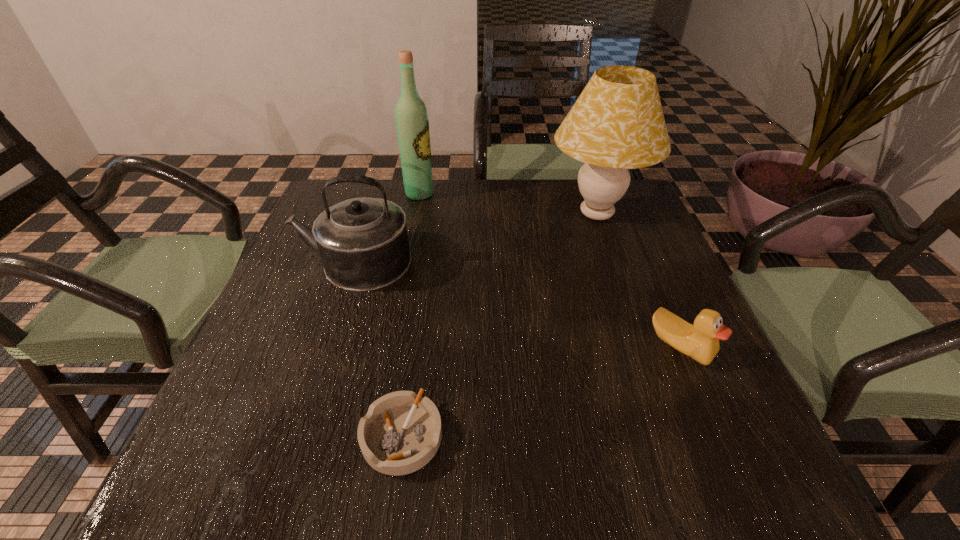
I want to click on vacant area at the left edge, so click(302, 316).

Where is `free space at the right edge of the desktop`? free space at the right edge of the desktop is located at coordinates (683, 280).

This screenshot has height=540, width=960. Find the location of `vacant point at the far left corner`. vacant point at the far left corner is located at coordinates (376, 197).

The height and width of the screenshot is (540, 960). Find the location of `vacant area at the near left corner of the desktop`. vacant area at the near left corner of the desktop is located at coordinates (262, 448).

The width and height of the screenshot is (960, 540). What are the coordinates of `blank space at the near right corner` in the screenshot? It's located at (730, 463).

Where is `empty location between the lampshade and the fourth tallest object`? The width and height of the screenshot is (960, 540). empty location between the lampshade and the fourth tallest object is located at coordinates (638, 281).

At what (x,y) coordinates should I click in order to perform the action: click on free area in between the fourth farthest object and the kettle. Please return your answer as a coordinate pair (x, y). This screenshot has width=960, height=540. Looking at the image, I should click on (517, 304).

This screenshot has width=960, height=540. What are the coordinates of `empty location between the shortest object and the lampshade` in the screenshot? It's located at (499, 325).

Identify the location of unoccupied position between the wine bottle and the lampshade. The width and height of the screenshot is (960, 540). (508, 204).

Locate an element on the screen. vacant area that lies between the lampshade and the kettle is located at coordinates (475, 238).